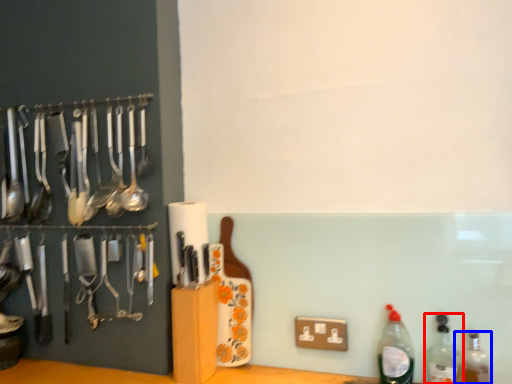
Question: Among these objects, which one is farthest to the camera, bottle (highlighted by a red box) or bottle (highlighted by a blue box)?

Choices:
 (A) bottle
 (B) bottle

Answer: (A)